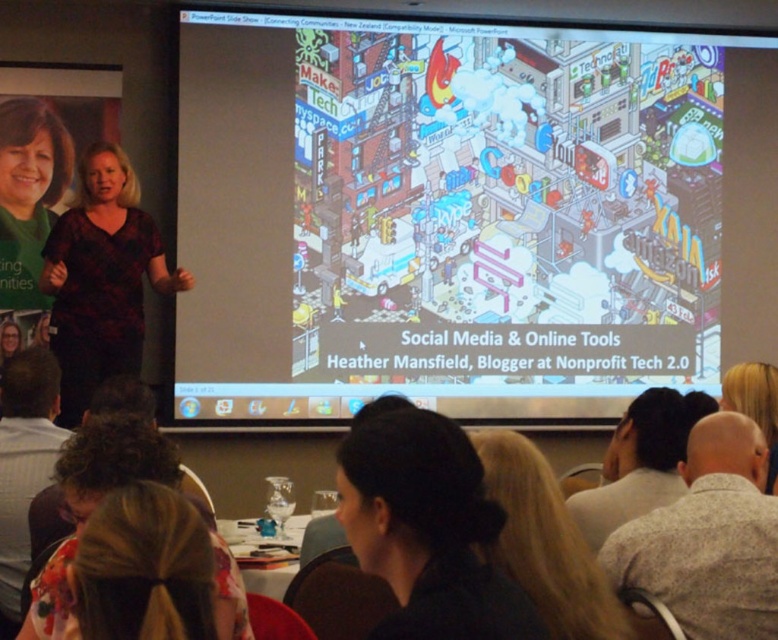
Which of these two, gray speckled shirt at lower right or gray wool sweater at lower right, stands taller?

gray speckled shirt at lower right is taller.

Looking at this image, how far apart are gray speckled shirt at lower right and gray wool sweater at lower right?

gray speckled shirt at lower right is 15.80 inches from gray wool sweater at lower right.

Between point (675, 596) and point (640, 490), which one is positioned behind?

Point (640, 490)

Find the location of a particular element. The image size is (778, 640). gray speckled shirt at lower right is located at coordinates (708, 538).

Does cartoonish illustration at center appear over black textured dress at left?

Yes.

Is cartoonish illustration at center wider than black textured dress at left?

Yes, cartoonish illustration at center is wider than black textured dress at left.

You are a GUI agent. You are given a task and a screenshot of the screen. Output one action in this format:
    pyautogui.click(x=<x>, y=<y>)
    Task: Click on the cartoonish illustration at center
    
    Given the screenshot: What is the action you would take?
    [x=444, y=216]

Is gray speckled shirt at lower right positioned behind green matte shirt at upper left?

That is False.

Is gray speckled shirt at lower right smaller than green matte shirt at upper left?

Actually, gray speckled shirt at lower right might be larger than green matte shirt at upper left.

Find the location of `gray speckled shirt at lower right`. gray speckled shirt at lower right is located at coordinates (708, 538).